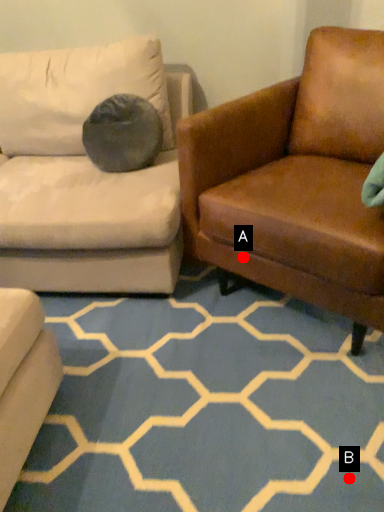
Question: Two points are circled on the image, labeled by A and B beside each circle. Which point appears closest to the camera in this image?

Choices:
 (A) A is closer
 (B) B is closer

Answer: (B)